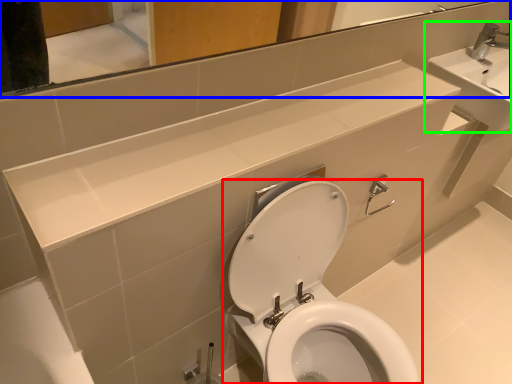
Question: Based on their relative distances, which object is nearer to toilet (highlighted by a red box)? Choose from mirror (highlighted by a blue box) and sink (highlighted by a green box).

Choices:
 (A) mirror
 (B) sink

Answer: (A)